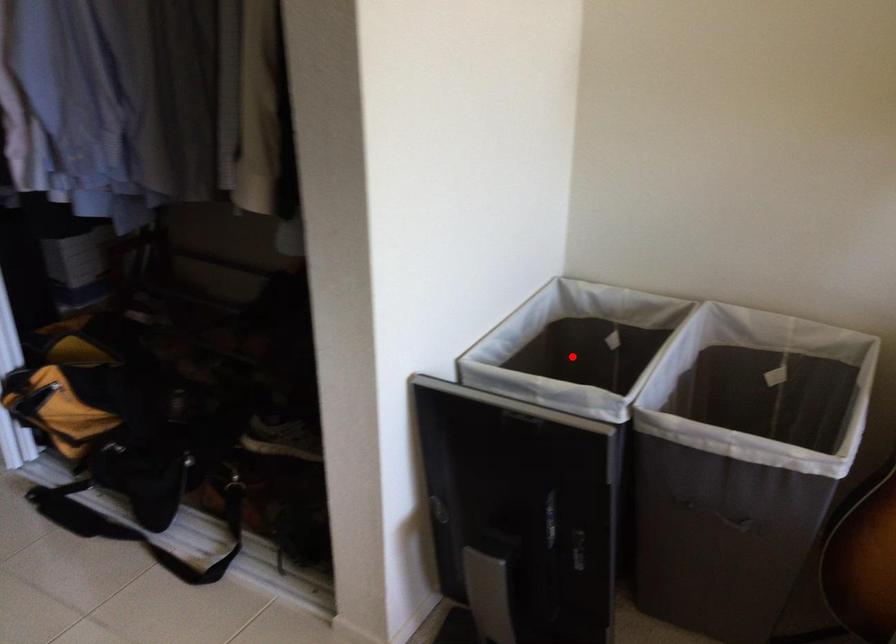
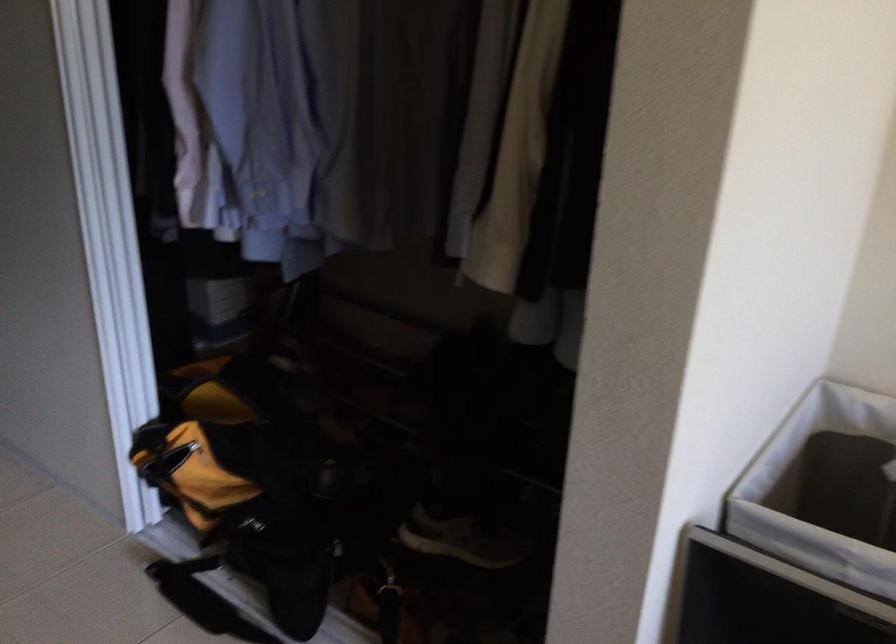
Question: I am providing you with two images of the same scene from different viewpoints. In image1, a red point is highlighted. Considering the same 3D point in image2, which of the following is correct?

Choices:
 (A) It is closer
 (B) It is farther

Answer: (A)